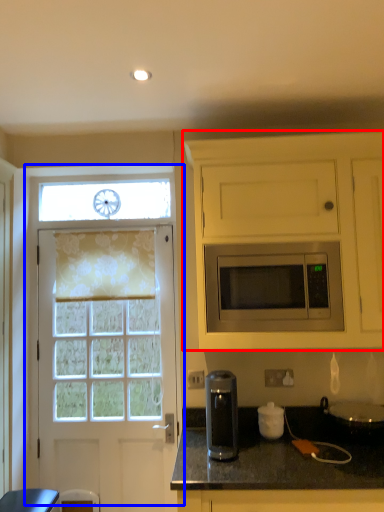
Question: Which of the following is the farthest to the observer, cabinetry (highlighted by a red box) or door (highlighted by a blue box)?

Choices:
 (A) cabinetry
 (B) door

Answer: (B)